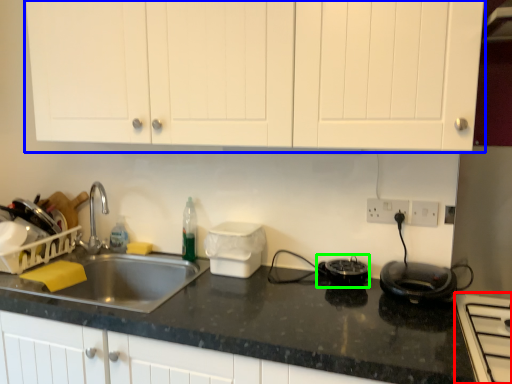
Question: Which is farther away from home appliance (highlighted by a red box)? cabinetry (highlighted by a blue box) or appliance (highlighted by a green box)?

Choices:
 (A) cabinetry
 (B) appliance

Answer: (A)